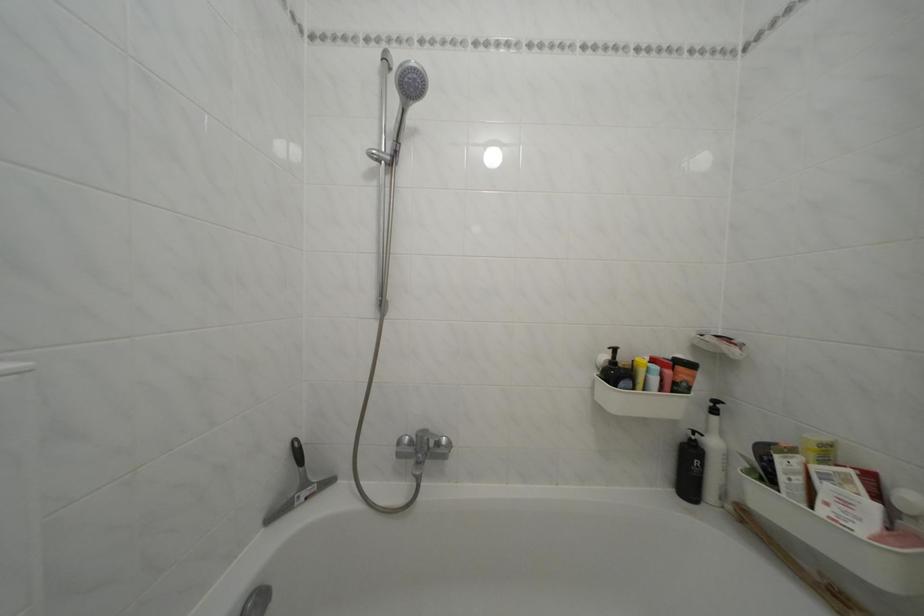
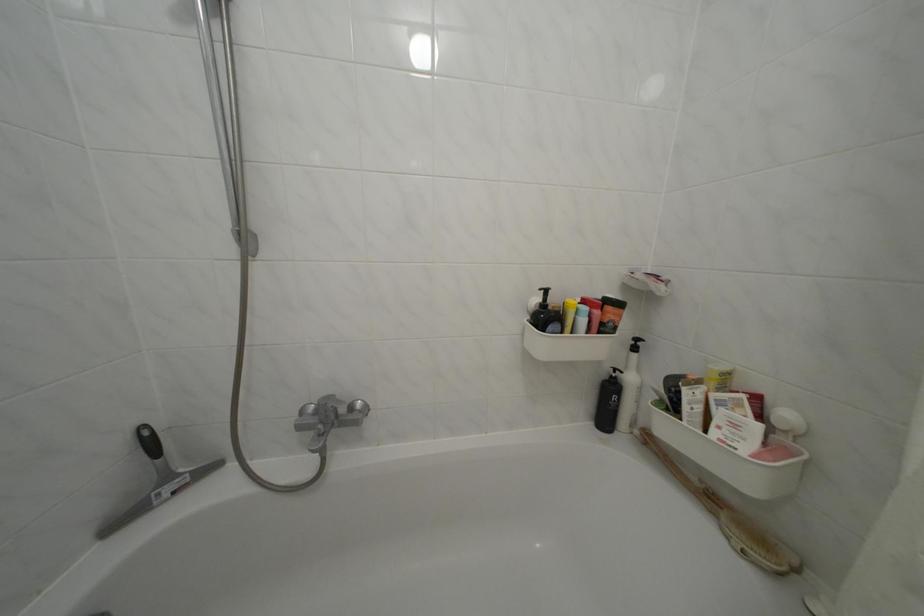
Question: The first image is from the beginning of the video and the second image is from the end. How did the camera likely rotate when shooting the video?

Choices:
 (A) Left
 (B) Right
 (C) Up
 (D) Down

Answer: (D)